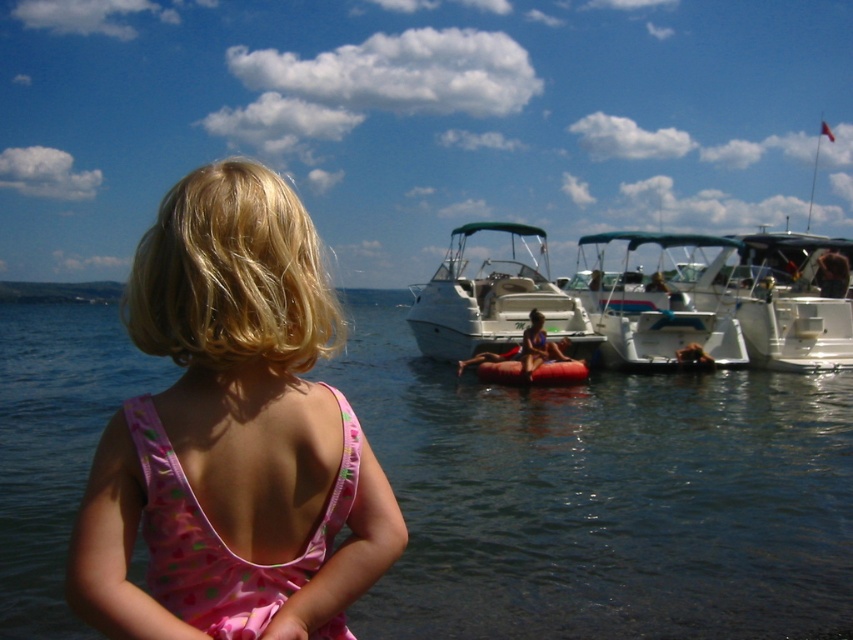
You are a photographer trying to capture a shot of the transparent water at center and the matte pink swimsuit at center. Based on their positions, which one would appear larger in the photo?

The transparent water at center appears larger in the photo because it is much taller than the matte pink swimsuit at center.

You are a photographer trying to capture the entire scene in one shot. You notice the pink fabric dress at lower left and the rubber red raft at center. Which object would require you to zoom out more to include both in the frame?

The rubber red raft at center requires zooming out more because it is wider than the pink fabric dress at lower left.